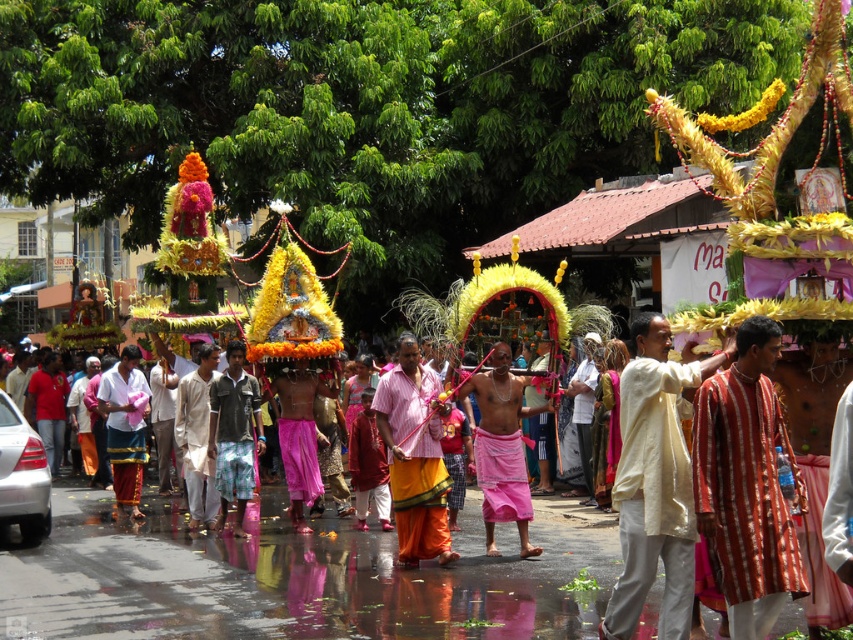
Question: Which is farther from the white cotton kurta at center?

Choices:
 (A) light beige cotton kurta at center
 (B) green plaid pants at center
 (C) matte pink saree at center

Answer: (C)

Question: Is green plaid pants at center to the left of matte pink saree at center from the viewer's perspective?

Choices:
 (A) no
 (B) yes

Answer: (A)

Question: Does striped cotton kurta at center lie behind pink cotton cloth at center?

Choices:
 (A) yes
 (B) no

Answer: (B)

Question: Is yellow cotton saree at center to the left of light beige cotton kurta at center from the viewer's perspective?

Choices:
 (A) yes
 (B) no

Answer: (B)

Question: Which object is farther from the camera taking this photo?

Choices:
 (A) pink cotton cloth at center
 (B) striped cotton kurta at center

Answer: (A)

Question: Which object appears farthest from the camera in this image?

Choices:
 (A) white cotton kurta at center
 (B) pink cotton cloth at center
 (C) green plaid pants at center
 (D) light beige cotton kurta at center

Answer: (D)